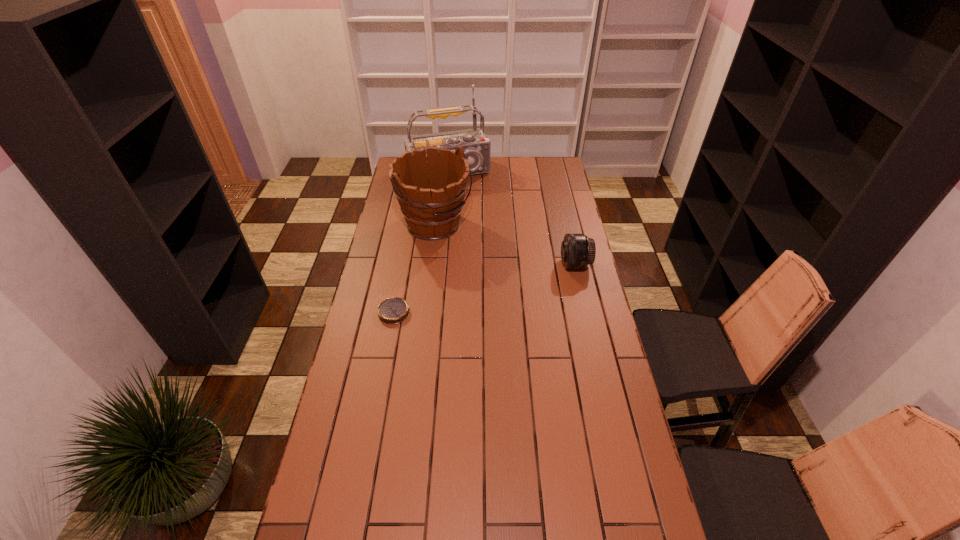
Locate an element on the screen. compass is located at coordinates (394, 310).

At what (x,y) coordinates should I click in order to perform the action: click on the nearest object. Please return your answer as a coordinate pair (x, y). This screenshot has width=960, height=540. Looking at the image, I should click on (394, 310).

Locate an element on the screen. The image size is (960, 540). the second nearest object is located at coordinates (577, 250).

At what (x,y) coordinates should I click in order to perform the action: click on the second shortest object. Please return your answer as a coordinate pair (x, y). The image size is (960, 540). Looking at the image, I should click on (577, 250).

The height and width of the screenshot is (540, 960). In order to click on the second farthest object in this screenshot , I will do `click(432, 207)`.

The height and width of the screenshot is (540, 960). Identify the location of wine bucket. (432, 207).

Locate an element on the screen. radio receiver is located at coordinates (476, 146).

Find the location of a particular element. The width and height of the screenshot is (960, 540). the tallest object is located at coordinates (476, 146).

Locate an element on the screen. The width and height of the screenshot is (960, 540). vacant space located on the front of the shortest object is located at coordinates (374, 418).

The width and height of the screenshot is (960, 540). Identify the location of vacant area situated 0.060m on the front-facing side of the second nearest object. (546, 265).